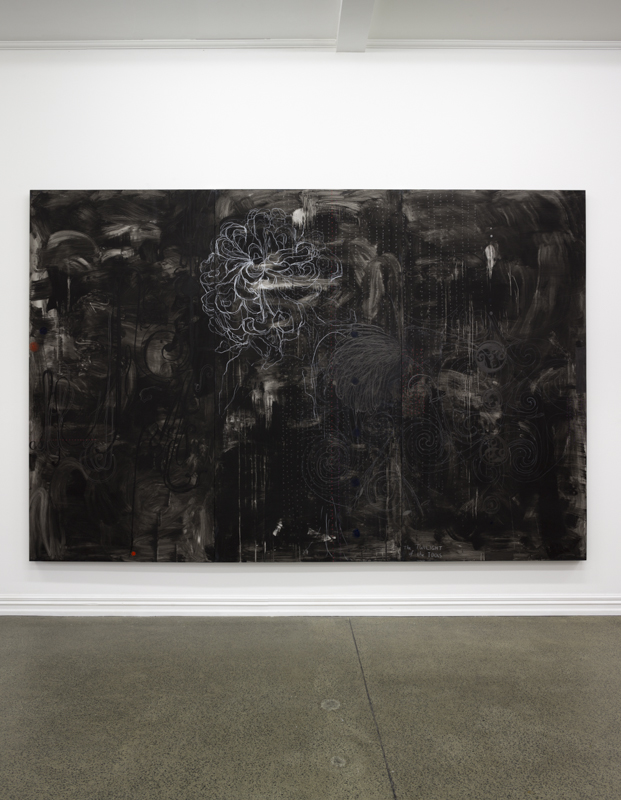
Where is `black and gray waves in painting`? Image resolution: width=621 pixels, height=800 pixels. black and gray waves in painting is located at coordinates (517, 226), (532, 218), (554, 209).